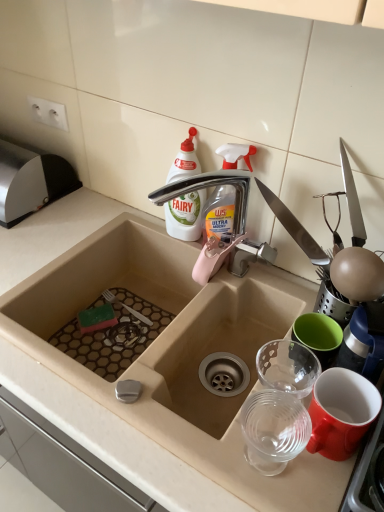
Question: Is white plastic bottle at upper center taller or shorter than transparent plastic cups at right?

Choices:
 (A) short
 (B) tall

Answer: (B)

Question: In terms of width, does white plastic bottle at upper center look wider or thinner when compared to transparent plastic cups at right?

Choices:
 (A) wide
 (B) thin

Answer: (B)

Question: Which object is the farthest from the white plastic bottle at upper center?

Choices:
 (A) transparent plastic spray bottle at upper center
 (B) satin silver knife block at upper left
 (C) silver metallic tap at upper center
 (D) beige ceramic sink at center
 (E) transparent plastic cups at right

Answer: (E)

Question: Which of these objects is positioned farthest from the beige ceramic sink at center?

Choices:
 (A) satin silver knife block at upper left
 (B) transparent plastic cups at right
 (C) transparent plastic spray bottle at upper center
 (D) white plastic bottle at upper center
 (E) silver metallic tap at upper center

Answer: (A)